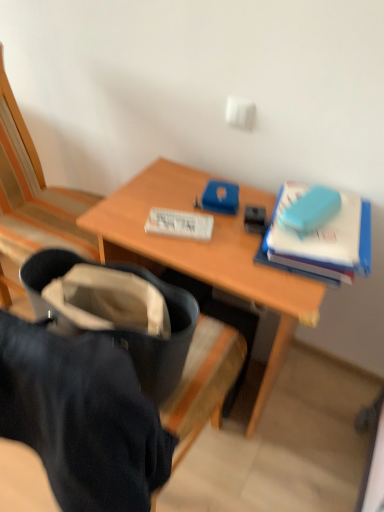
In order to click on free space to the back side of white paper at center, which appears as the second paperback book when viewed from the right in this screenshot , I will do `click(177, 190)`.